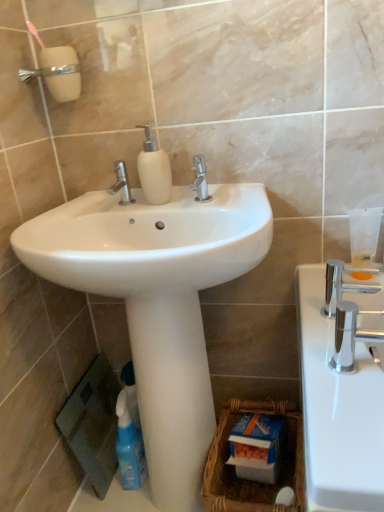
Locate an element on the screen. free space to the left of white matte soap dispenser at center is located at coordinates pyautogui.click(x=109, y=210).